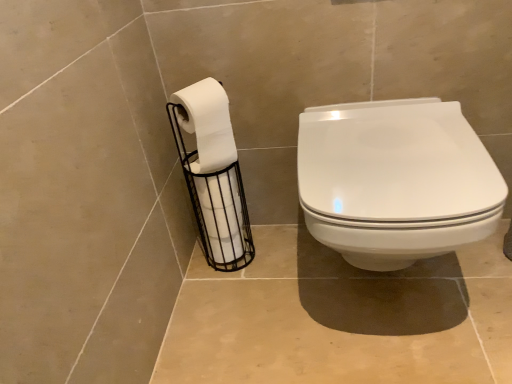
Question: Considering the positions of point (218, 92) and point (244, 195), is point (218, 92) closer or farther from the camera than point (244, 195)?

Choices:
 (A) closer
 (B) farther

Answer: (A)

Question: In terms of size, does white matte toilet paper at left, which ranks as the second toilet paper in bottom-to-top order, appear bigger or smaller than white matte toilet paper at left, marked as the 2th toilet paper in a top-to-bottom arrangement?

Choices:
 (A) big
 (B) small

Answer: (B)

Question: Estimate the real-world distances between objects in this image. Which object is closer to the white matte toilet paper at left, which ranks as the second toilet paper in bottom-to-top order?

Choices:
 (A) white glossy toilet seat at center
 (B) white matte toilet paper at left, marked as the 2th toilet paper in a top-to-bottom arrangement

Answer: (B)

Question: Estimate the real-world distances between objects in this image. Which object is closer to the white glossy toilet seat at center?

Choices:
 (A) white matte toilet paper at left, marked as the 2th toilet paper in a top-to-bottom arrangement
 (B) white matte toilet paper at left, which appears as the 1th toilet paper when viewed from the top

Answer: (B)